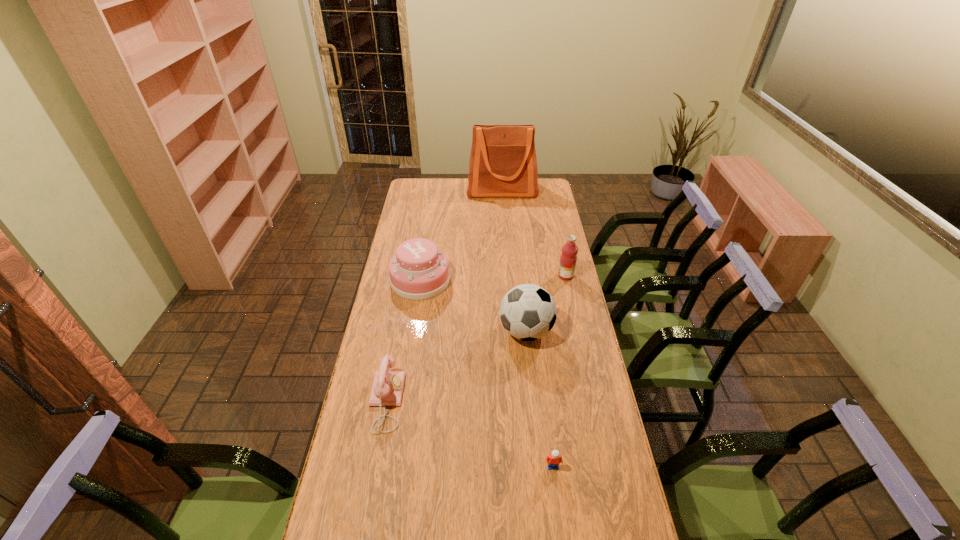
This screenshot has height=540, width=960. What are the coordinates of `free space that satisfies the following two spatial constraints: 1. on the label of the rightmost object; 2. on the front side of the third shortest object` in the screenshot? It's located at (566, 280).

The height and width of the screenshot is (540, 960). In order to click on vacant space that satisfies the following two spatial constraints: 1. on the front pocket of the shopping bag; 2. on the dial of the fifth farthest object in this screenshot , I will do `click(517, 401)`.